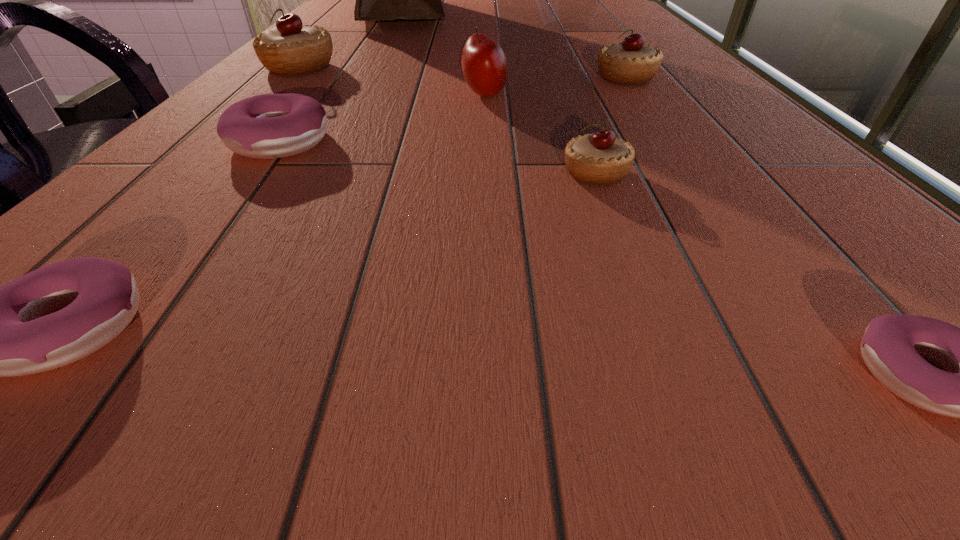
Locate an element on the screen. The height and width of the screenshot is (540, 960). the farthest pink pastry is located at coordinates (266, 126).

Find the location of a particular element. The image size is (960, 540). the fourth tallest pastry is located at coordinates (266, 126).

Find the location of `free space located on the front-facing side of the tallest object`. free space located on the front-facing side of the tallest object is located at coordinates (577, 15).

Where is `vacant space positioned on the left of the eighth shortest object`? This screenshot has height=540, width=960. vacant space positioned on the left of the eighth shortest object is located at coordinates (476, 27).

Locate an element on the screen. The width and height of the screenshot is (960, 540). blank space located on the back of the biggest beige pastry is located at coordinates (317, 49).

Where is `vacant space situated on the front of the apple`? vacant space situated on the front of the apple is located at coordinates (487, 214).

Where is `vacant space located on the front of the second tallest pastry`? This screenshot has height=540, width=960. vacant space located on the front of the second tallest pastry is located at coordinates (707, 190).

Where is `vacant space situated on the left of the smallest beige pastry`? vacant space situated on the left of the smallest beige pastry is located at coordinates (471, 173).

The height and width of the screenshot is (540, 960). I want to click on free spot located 0.300m on the front of the third shortest object, so click(x=134, y=333).

Locate an element on the screen. The image size is (960, 540). grocery bag that is at the far edge is located at coordinates (376, 0).